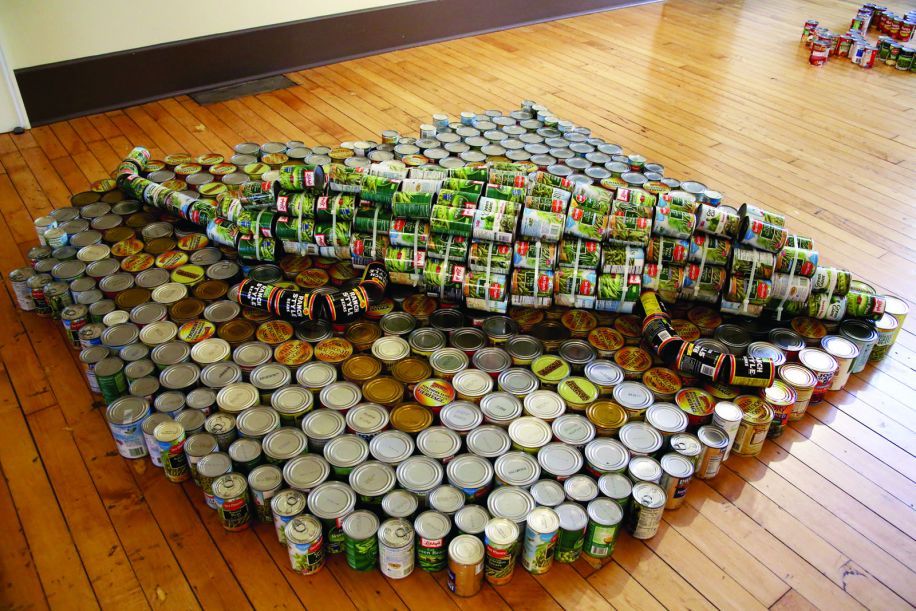
I want to click on wall, so click(x=311, y=33).